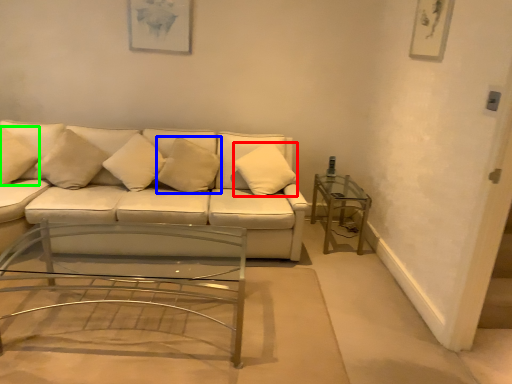
Question: Which is nearer to the pillow (highlighted by a red box)? pillow (highlighted by a blue box) or pillow (highlighted by a green box).

Choices:
 (A) pillow
 (B) pillow

Answer: (A)